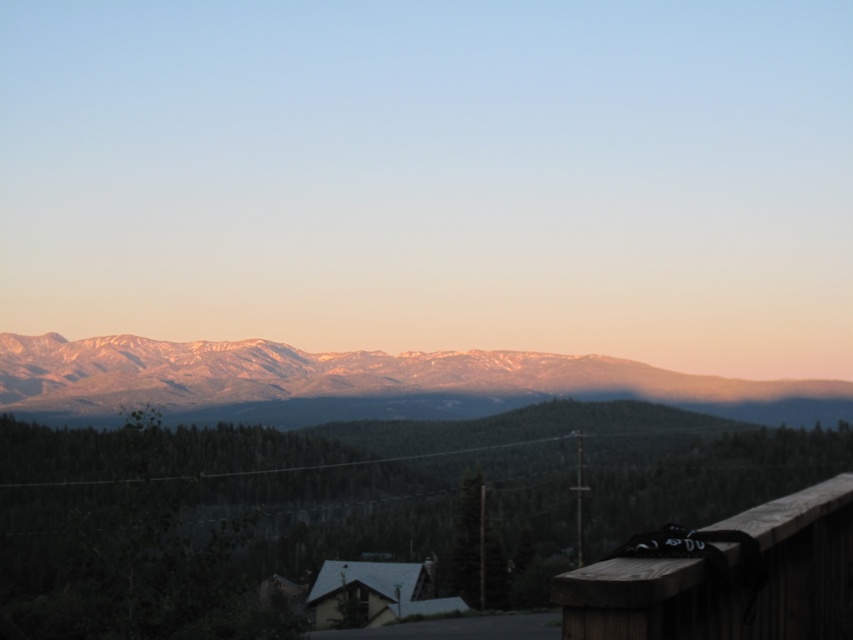
Question: Is snowy mountain range at upper center smaller than wooden rail at lower right?

Choices:
 (A) yes
 (B) no

Answer: (B)

Question: Which point is farther from the camera taking this photo?

Choices:
 (A) (643, 557)
 (B) (90, 396)

Answer: (B)

Question: Which point is closer to the camera?

Choices:
 (A) snowy mountain range at upper center
 (B) wooden rail at lower right

Answer: (B)

Question: Which point is closer to the camera taking this photo?

Choices:
 (A) (584, 628)
 (B) (373, 392)

Answer: (A)

Question: Does snowy mountain range at upper center appear over wooden rail at lower right?

Choices:
 (A) yes
 (B) no

Answer: (B)

Question: Is snowy mountain range at upper center wider than wooden rail at lower right?

Choices:
 (A) no
 (B) yes

Answer: (B)